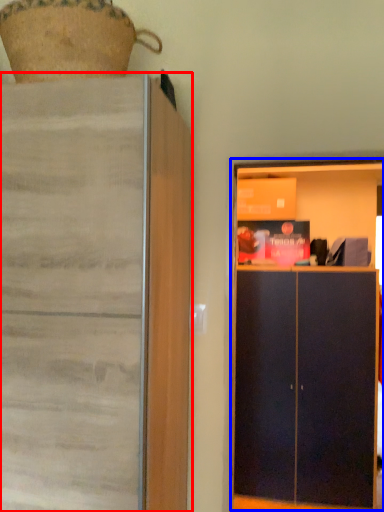
Question: Which point is further to the camera, cupboard (highlighted by a red box) or dresser (highlighted by a blue box)?

Choices:
 (A) cupboard
 (B) dresser

Answer: (B)